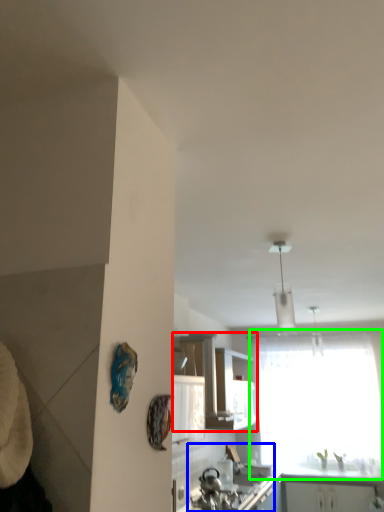
Question: Based on their relative distances, which object is farther from cabinetry (highlighted by a red box)? Choose from sink (highlighted by a blue box) and window (highlighted by a green box).

Choices:
 (A) sink
 (B) window

Answer: (B)